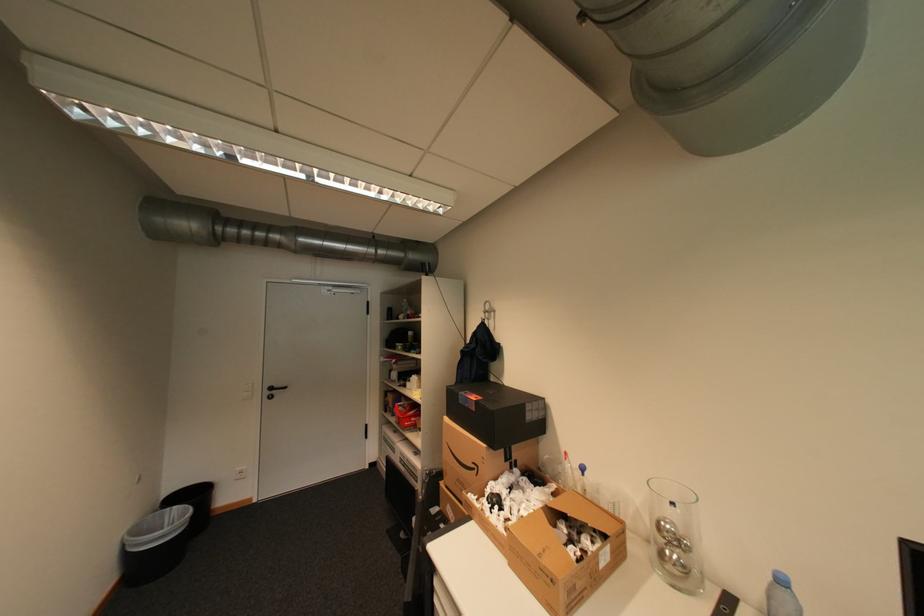
Where would you lift the red plastic tub? Please return your answer as a coordinate pair (x, y).

(407, 414)